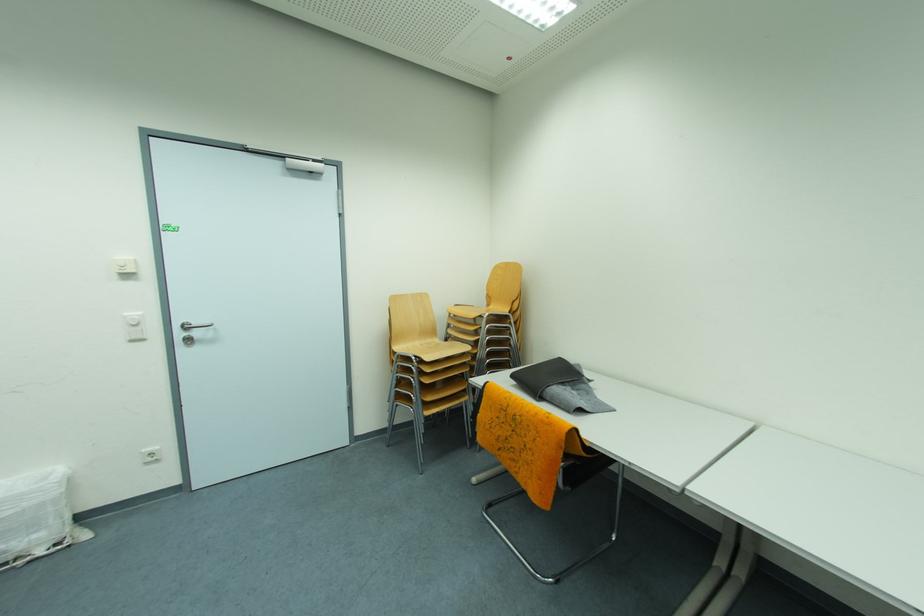
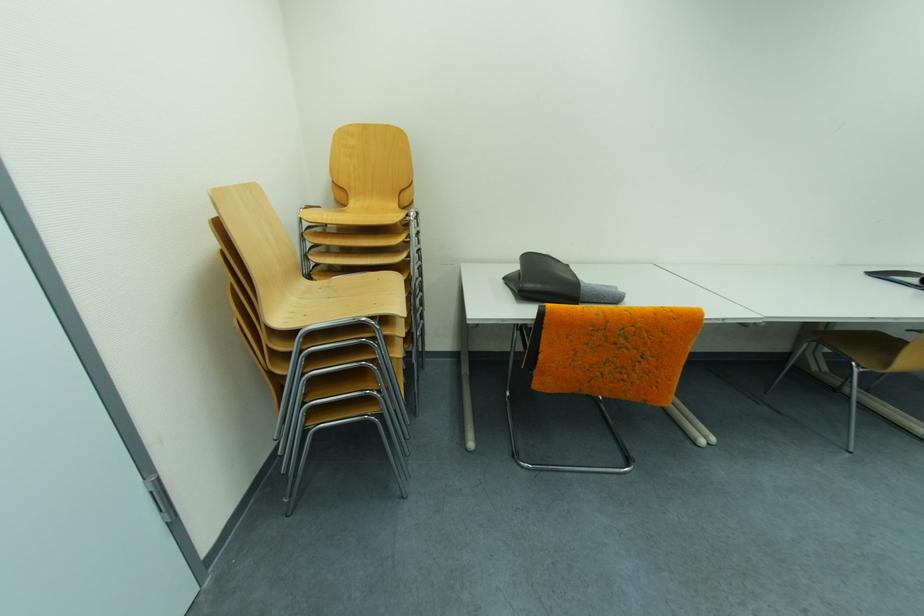
Locate, in the second image, the point that corresponds to point 488,416 in the first image.

(549, 359)